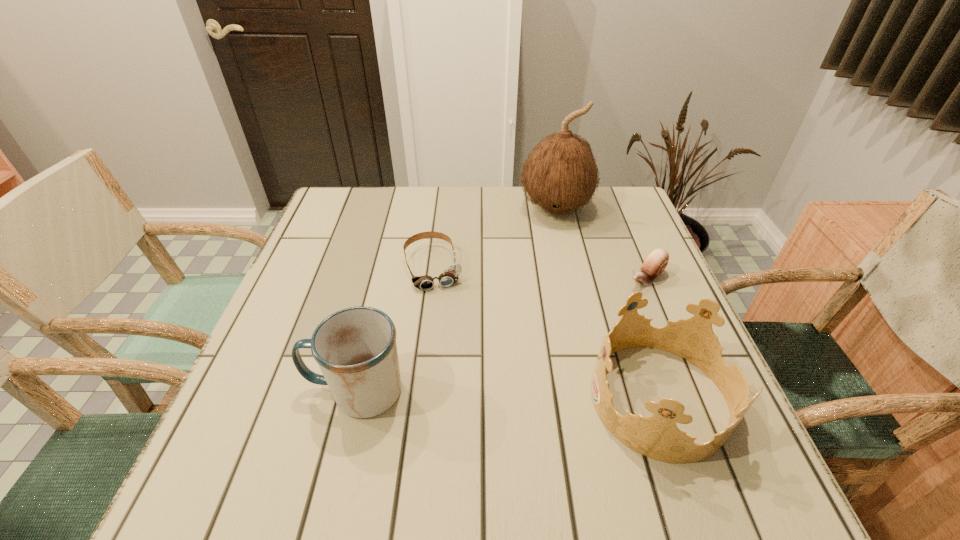
This screenshot has height=540, width=960. In the image, there is a desktop. What are the coordinates of `vacant space at the far edge` in the screenshot? It's located at (456, 218).

The image size is (960, 540). Find the location of `vacant space at the near edge`. vacant space at the near edge is located at coordinates (333, 404).

You are a GUI agent. You are given a task and a screenshot of the screen. Output one action in this format:
    pyautogui.click(x=<x>, y=<y>)
    Task: Click on the vacant space at the left edge of the desktop
    
    Given the screenshot: What is the action you would take?
    pyautogui.click(x=330, y=247)

Identify the location of vacant space at the right edge of the desktop. (623, 243).

Locate an element on the screen. vacant space at the far left corner is located at coordinates (317, 222).

Locate an element on the screen. The height and width of the screenshot is (540, 960). vacant region between the second shortest object and the goggles is located at coordinates (540, 273).

Locate an element on the screen. The height and width of the screenshot is (540, 960). vacant space that is in between the escargot and the mug is located at coordinates (501, 335).

Locate an element on the screen. This screenshot has height=540, width=960. vacant space that's between the farthest object and the tiara is located at coordinates (608, 303).

I want to click on free space between the shortest object and the second shortest object, so click(540, 273).

I want to click on empty location between the coconut and the second shortest object, so click(601, 244).